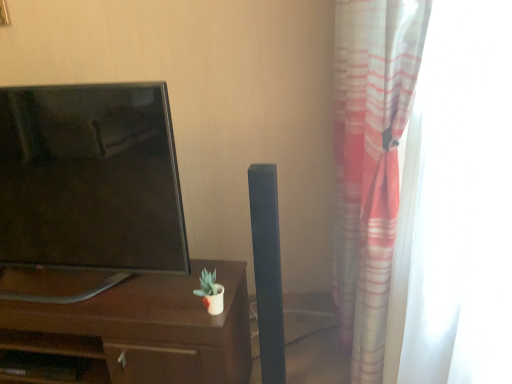
The width and height of the screenshot is (512, 384). In order to click on vacant area situated below matte black tv at left (from a real-world perspective) in this screenshot , I will do `click(84, 289)`.